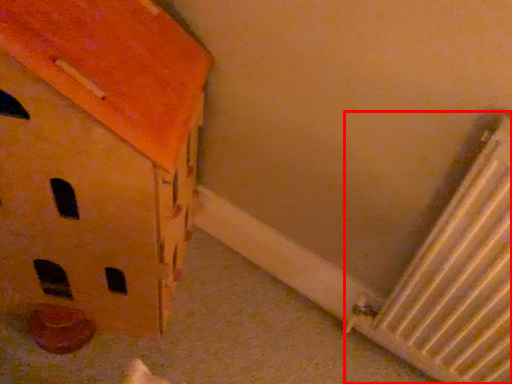
Question: Observing the image, what is the correct spatial positioning of radiator (annotated by the red box) in reference to cardboard box?

Choices:
 (A) right
 (B) left

Answer: (A)